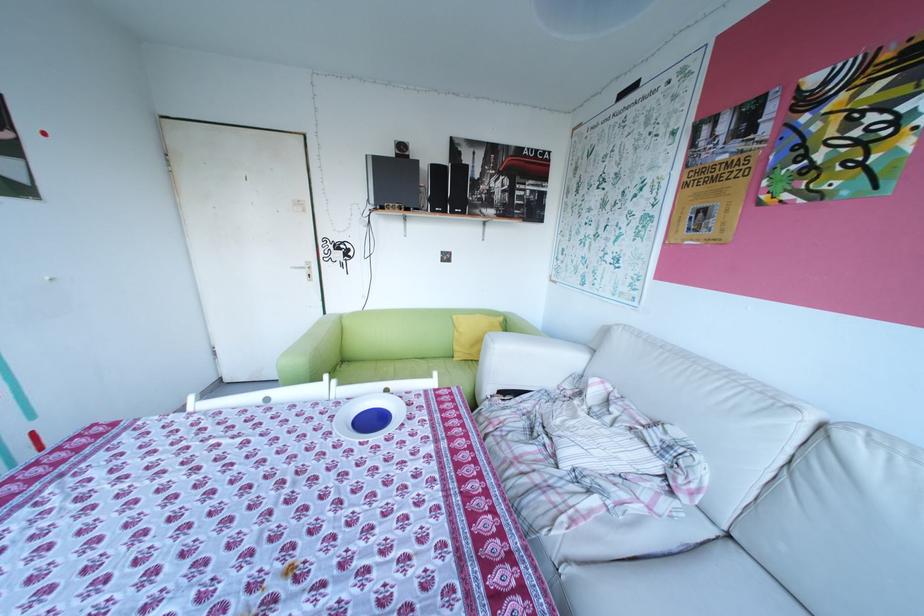
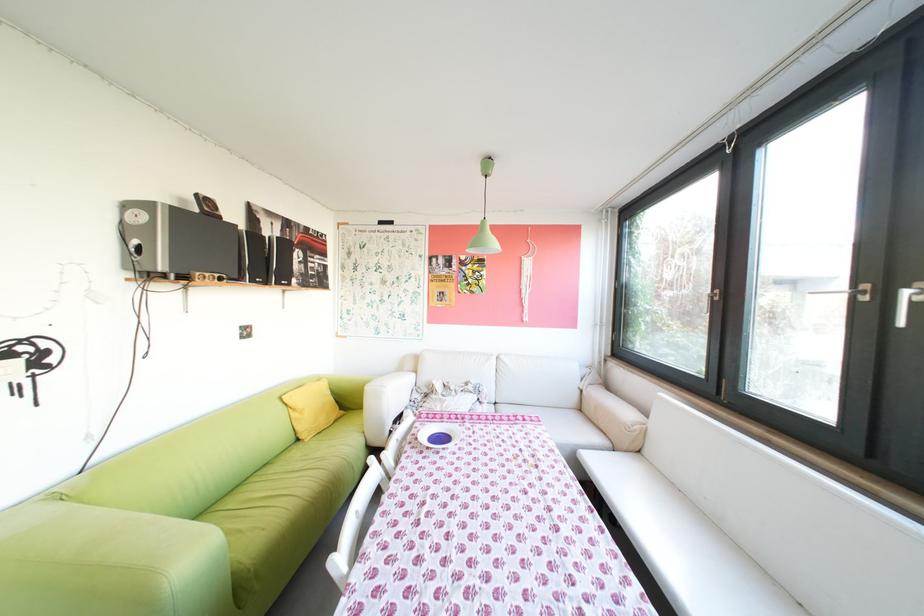
The point at (467, 359) is marked in the first image. Where is the corresponding point in the second image?

(321, 440)